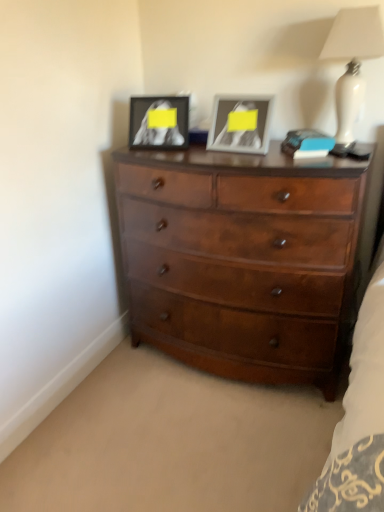
Where is `space that is in front of shiny brown wooden chest of drawers at center`? space that is in front of shiny brown wooden chest of drawers at center is located at coordinates coord(206,439).